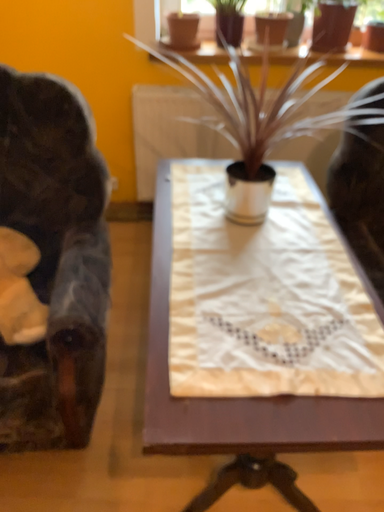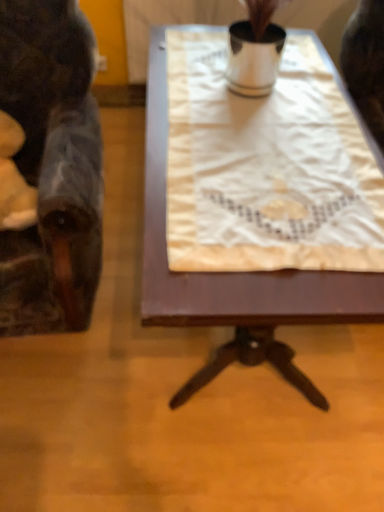
Question: How did the camera likely rotate when shooting the video?

Choices:
 (A) rotated downward
 (B) rotated upward

Answer: (A)